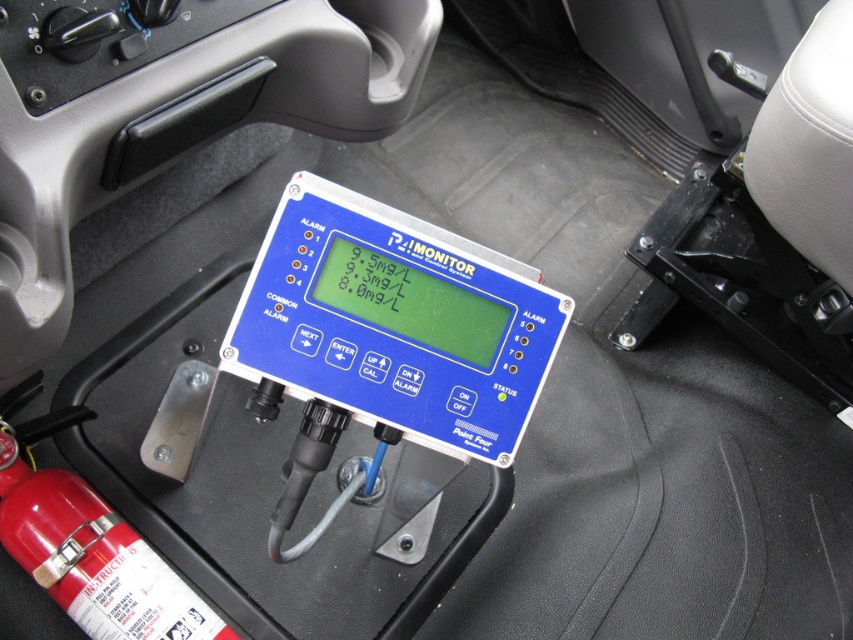
You are a technician inside the vehicle and need to access both the blue plastic monitor at center and the red matte fire extinguisher at lower left. Which object is taller?

The blue plastic monitor at center is much taller than the red matte fire extinguisher at lower left.

You are a technician inside the vehicle and need to locate two calibration points. The first calibration point is labeled as point [491,337] and the second is point [160,561]. From your current position, which point is closer to you?

Point [491,337] is in front of point [160,561], so the first calibration point is closer to you.

You are a technician checking the vehicle interior. You need to place a new tool box between the blue plastic monitor at center and the red matte fire extinguisher at lower left. Can you fit it there?

The blue plastic monitor at center might be wider than red matte fire extinguisher at lower left, so the space between them may not be sufficient for the tool box. Check the exact dimensions before placing it.